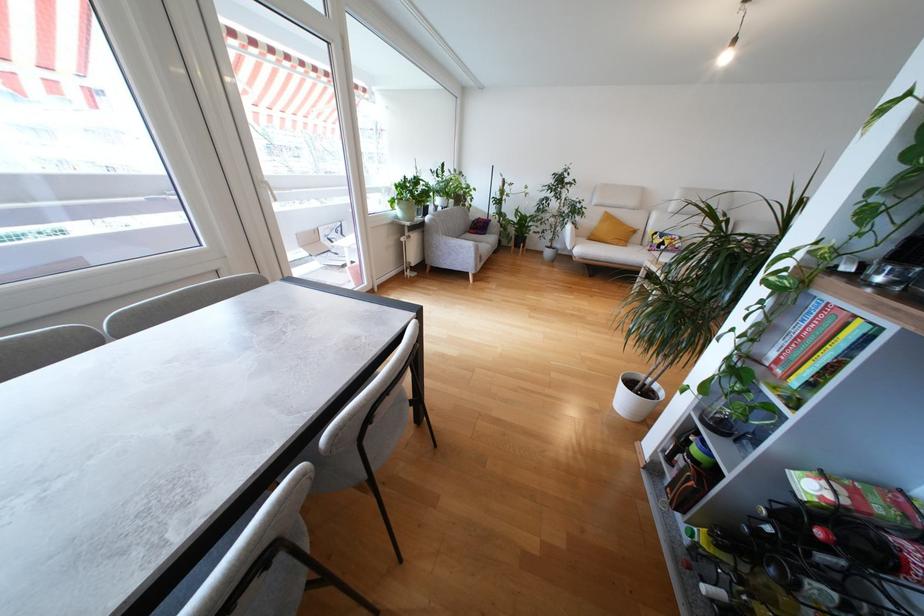
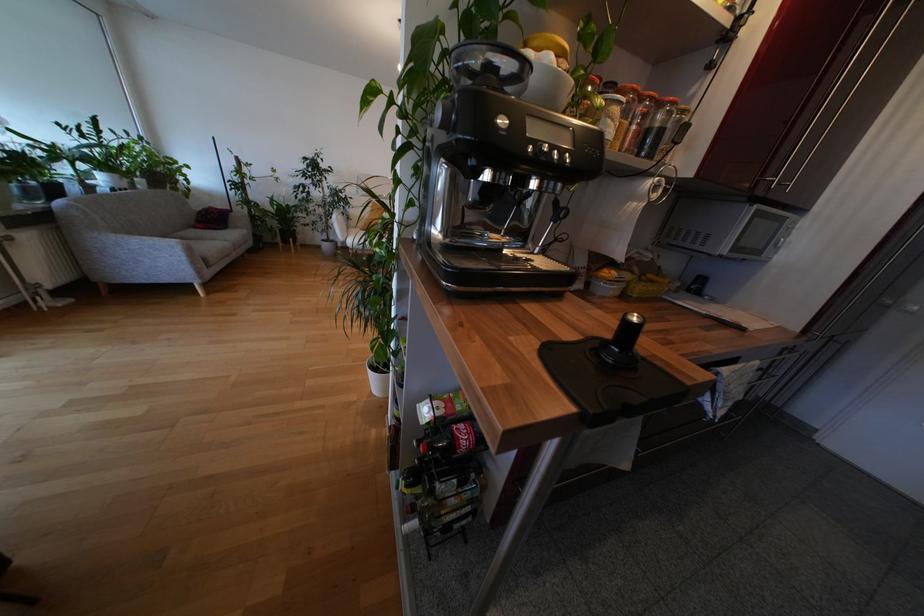
Find the pixel in the second image that matches (813,475) in the first image.

(431, 402)